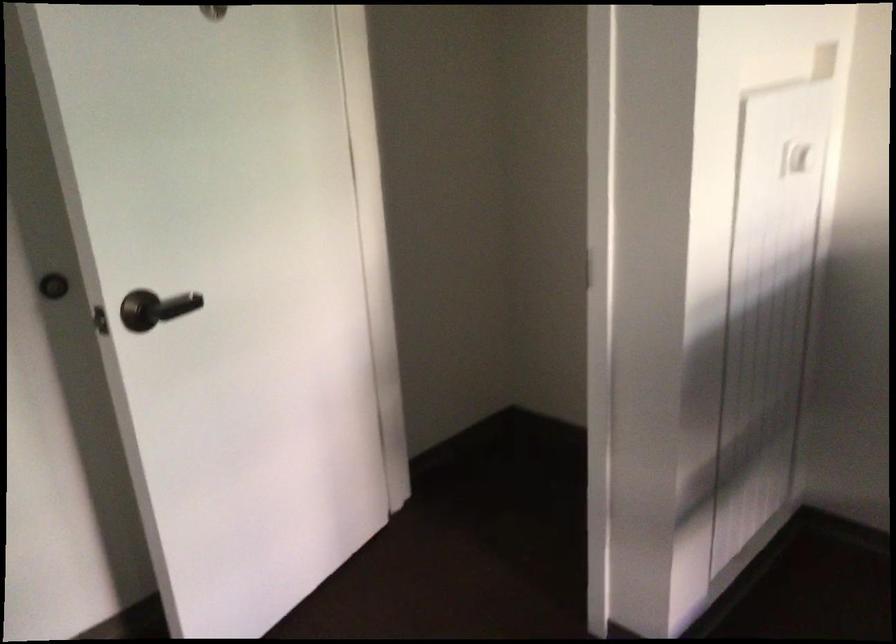
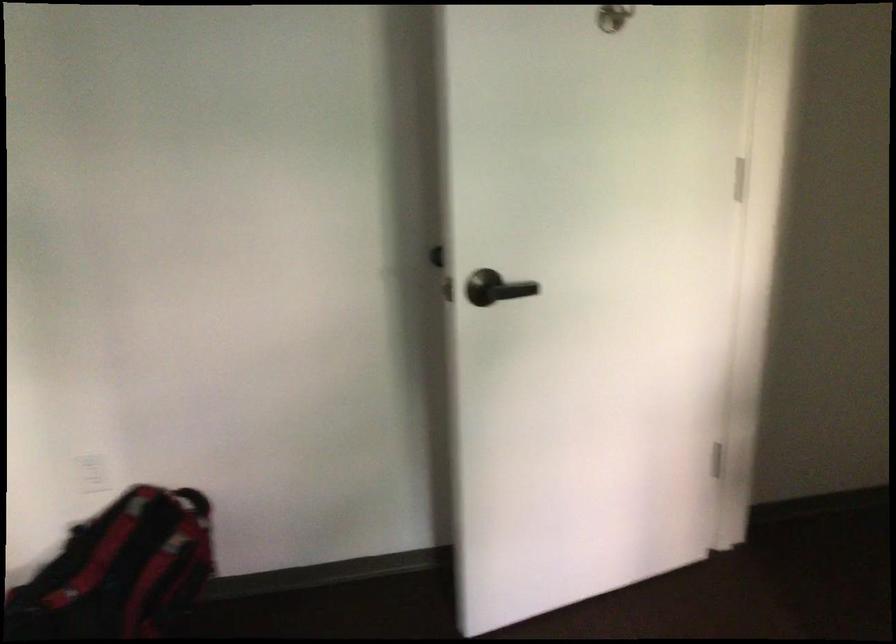
Locate, in the second image, the point that corresponds to point (159, 308) in the first image.

(495, 288)